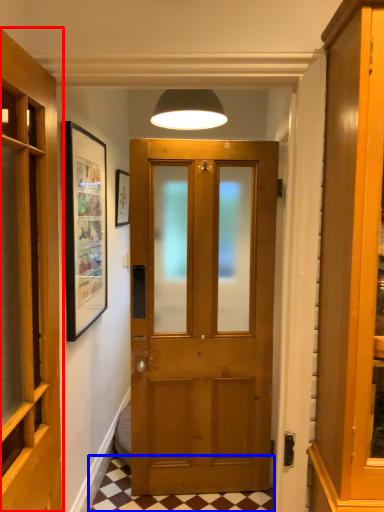
Question: Which point is further to the camera, door (highlighted by a red box) or tile (highlighted by a blue box)?

Choices:
 (A) door
 (B) tile

Answer: (B)